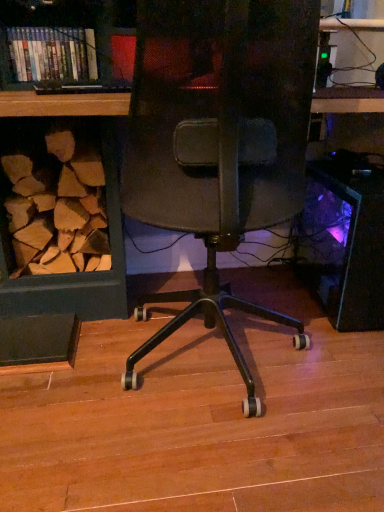
Locate an element on the screen. This screenshot has height=512, width=384. vacant point to the left of black plastic desktop at right is located at coordinates (264, 300).